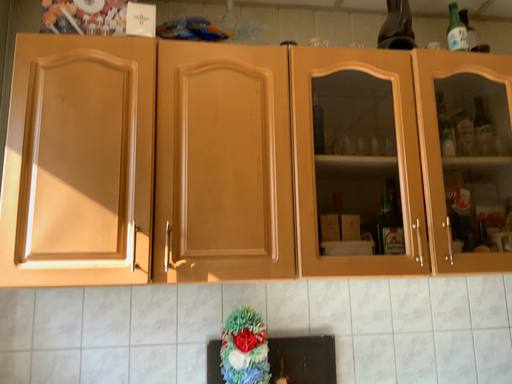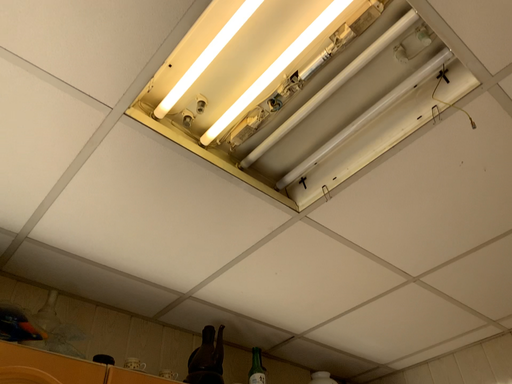
Question: Which way did the camera rotate in the video?

Choices:
 (A) rotated left
 (B) rotated right

Answer: (B)